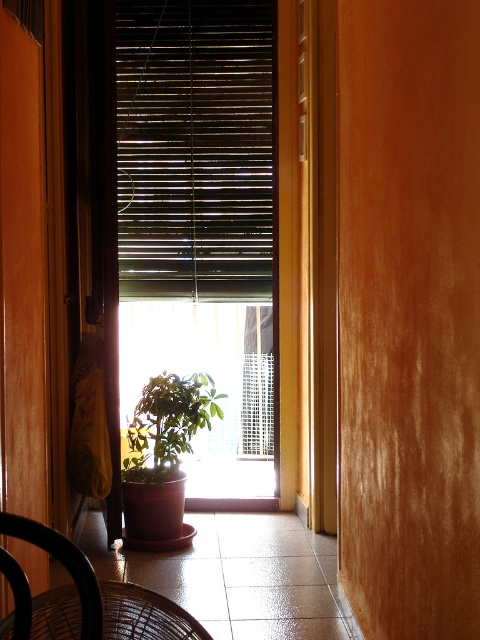
You are standing at the entrance of the corridor and see the point marked as point (x=144, y=614). What object is located at that point?

The point (x=144, y=614) corresponds to the black wire chair at lower left.

You are trying to move a 1.2 meter wide sofa through the narrow corridor. You see the black wire chair at lower left and the brown woven chair at lower left in your way. Which chair should you move to give more space for the sofa?

The black wire chair at lower left might be wider than the brown woven chair at lower left, so moving the black wire chair at lower left would provide more space for the sofa.

You are moving a black wire chair at lower left into the corridor and need to pass by the green matte plant at lower center. Will the chair fit through the space between the plant and the wall?

The green matte plant at lower center is wider than the black wire chair at lower left, so there should be enough space for the chair to pass by the plant and the wall.